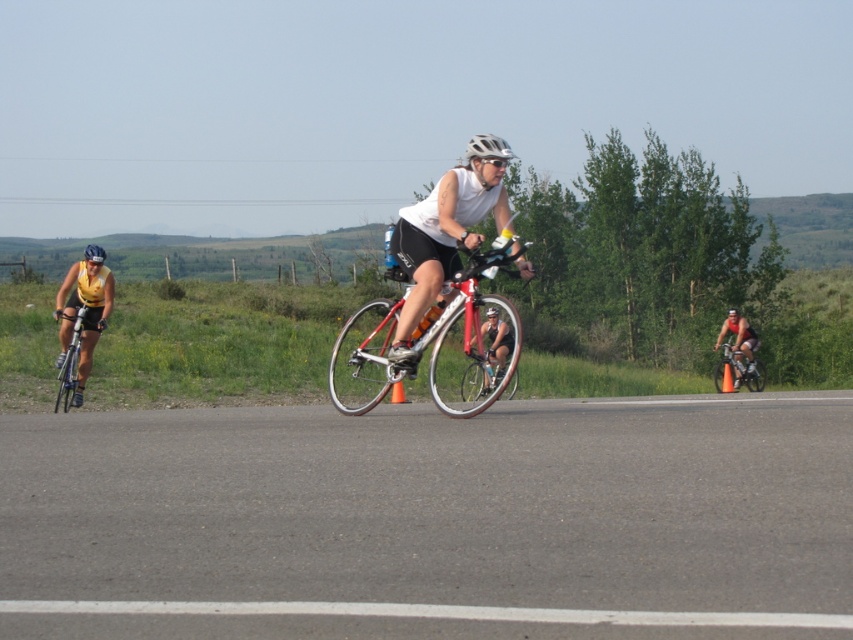
Does point (468, 150) come closer to viewer compared to point (84, 253)?

That is True.

Who is more distant from viewer, (474, 136) or (96, 256)?

The point (474, 136) is more distant.

Identify the location of white matte helmet at center. (486, 147).

Is shiny metallic bicycle at center smaller than white matte helmet at center?

Yes, shiny metallic bicycle at center is smaller than white matte helmet at center.

Which is in front, point (511, 340) or point (479, 150)?

Positioned in front is point (479, 150).

Is point (376, 332) positioned after point (508, 147)?

That is True.

At what (x,y) coordinates should I click in order to perform the action: click on shiny metallic bicycle at center. Please return your answer as a coordinate pair (x, y). Looking at the image, I should click on (469, 340).

Does point (73, 372) lie behind point (93, 256)?

No, (73, 372) is in front of (93, 256).

Can you confirm if shiny silver bicycle at left is wider than blue matte bicycle helmet at left?

Incorrect, shiny silver bicycle at left's width does not surpass blue matte bicycle helmet at left's.

You are a GUI agent. You are given a task and a screenshot of the screen. Output one action in this format:
    pyautogui.click(x=<x>, y=<y>)
    Task: Click on the shiny silver bicycle at left
    This screenshot has width=853, height=640.
    Given the screenshot: What is the action you would take?
    pyautogui.click(x=73, y=356)